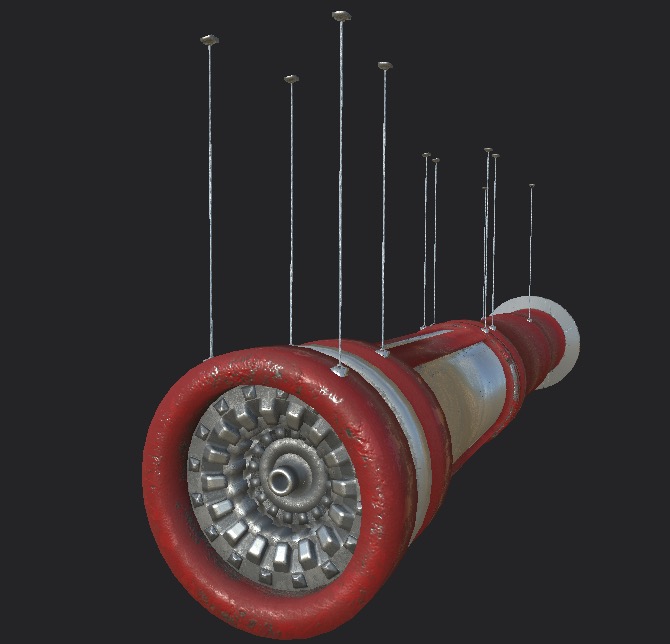
In order to click on suspension rods in this screenshot , I will do `click(206, 37)`, `click(293, 80)`, `click(338, 14)`, `click(386, 68)`, `click(423, 155)`, `click(435, 160)`, `click(482, 185)`, `click(532, 185)`, `click(494, 153)`, `click(488, 147)`.